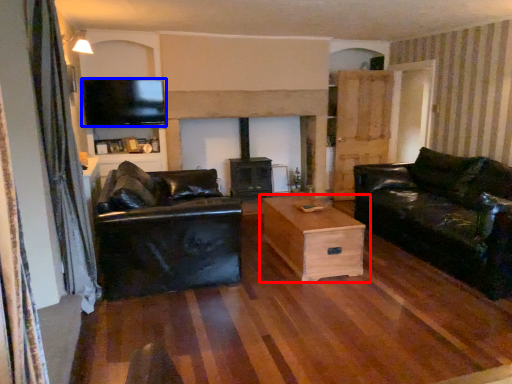
Question: Which object is closer to the camera taking this photo, table (highlighted by a red box) or television (highlighted by a blue box)?

Choices:
 (A) table
 (B) television

Answer: (A)